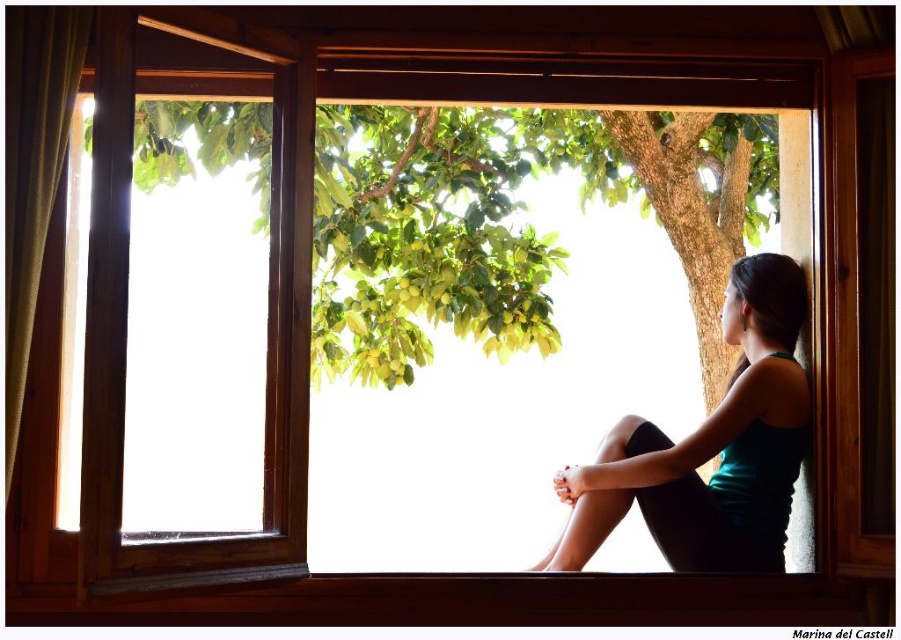
You are standing in the room and want to place a small plant between the two points, point [742,113] and point [733,289]. Which point should the plant be closer to so it is in front of the other point?

The plant should be closer to point [733,289] because point [742,113] is behind point [733,289], so placing it near the front point keeps it visible.

You are a photographer trying to capture the person in the scene. The teal fabric tank top at right and the green textured curtain at left are both in your view. Which object is closer to your camera lens?

The teal fabric tank top at right is closer to the camera lens because it is further to the viewer than the green textured curtain at left.

You are an interior designer observing the scene. You need to place a new decorative item between the teal fabric tank top at right and the green textured curtain at left. Based on their positions, which object should the new item be closer to?

The new decorative item should be placed closer to the green textured curtain at left because the teal fabric tank top at right is positioned to the right of the green textured curtain at left.